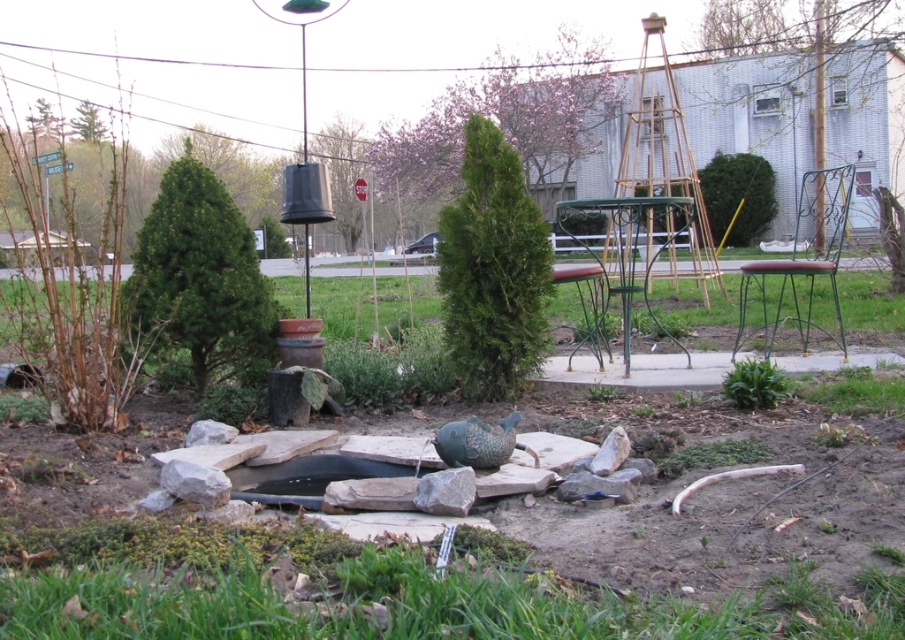
Is green textured tree at left wider than green leafy tree at right?

No.

Who is more distant from viewer, (187,224) or (808,129)?

Positioned behind is point (808,129).

The image size is (905, 640). I want to click on green textured tree at left, so click(199, 276).

Is green textured tree at left thinner than green textured tree at center?

No.

What do you see at coordinates (199, 276) in the screenshot? I see `green textured tree at left` at bounding box center [199, 276].

Describe the element at coordinates (199, 276) in the screenshot. I see `green textured tree at left` at that location.

Identify the location of green textured tree at left. Image resolution: width=905 pixels, height=640 pixels. (199, 276).

Can you confirm if green textured evergreen tree at center is shorter than green leafy tree at right?

Indeed, green textured evergreen tree at center has a lesser height compared to green leafy tree at right.

Which is below, green textured evergreen tree at center or green leafy tree at right?

green textured evergreen tree at center is lower down.

Does point (449, 300) come in front of point (821, 104)?

Yes, it is in front of point (821, 104).

Where is `green textured evergreen tree at center`? The height and width of the screenshot is (640, 905). green textured evergreen tree at center is located at coordinates (492, 269).